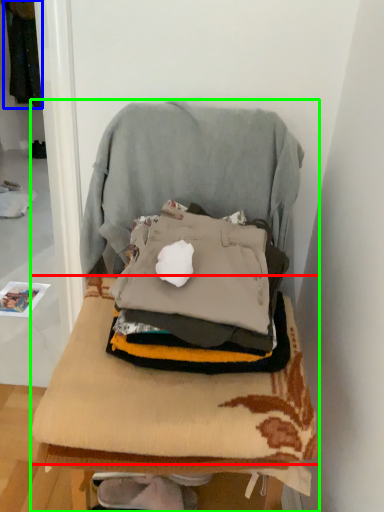
Question: Based on their relative distances, which object is nearer to blanket (highlighted by a red box)? Choose from clothing (highlighted by a blue box) and furniture (highlighted by a green box).

Choices:
 (A) clothing
 (B) furniture

Answer: (B)